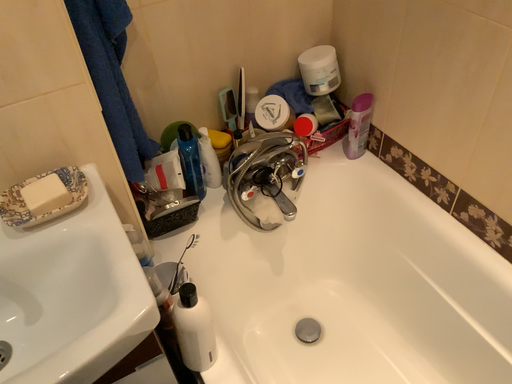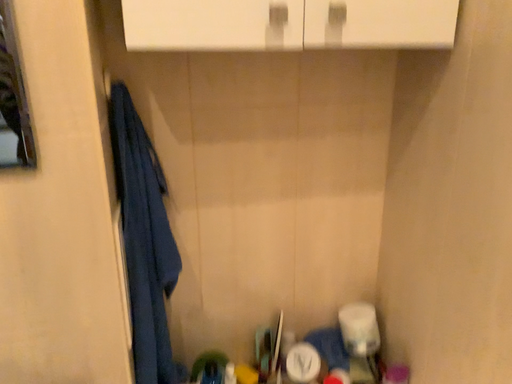
Question: Which way did the camera rotate in the video?

Choices:
 (A) rotated left
 (B) rotated right

Answer: (A)